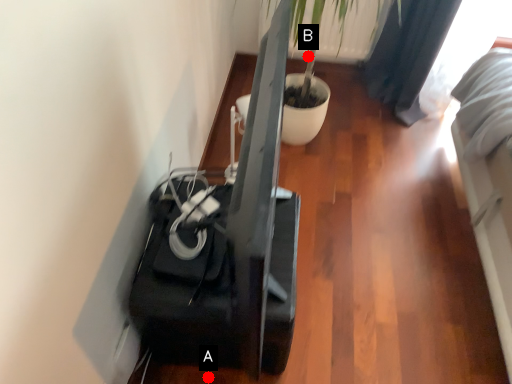
Question: Two points are circled on the image, labeled by A and B beside each circle. Which point is closer to the camera?

Choices:
 (A) A is closer
 (B) B is closer

Answer: (A)